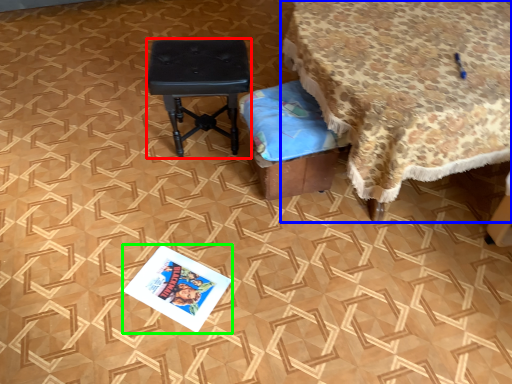
Question: Which object is the farthest from stool (highlighted by a red box)? Choose among these: table (highlighted by a blue box) or magazine (highlighted by a green box).

Choices:
 (A) table
 (B) magazine

Answer: (B)